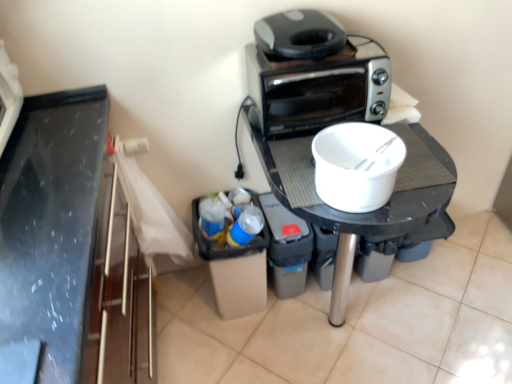
Question: Is white matte bowl at center taller or shorter than silver metallic toaster at upper center?

Choices:
 (A) tall
 (B) short

Answer: (B)

Question: From the image's perspective, relative to silver metallic toaster at upper center, is white matte bowl at center above or below?

Choices:
 (A) above
 (B) below

Answer: (B)

Question: Which object is the closest to the white matte bowl at center?

Choices:
 (A) black plastic table at center
 (B) gray plastic toaster oven at upper right
 (C) silver metallic toaster at upper center
 (D) black plastic trash can at lower center

Answer: (A)

Question: Which of these objects is positioned closest to the black plastic trash can at lower center?

Choices:
 (A) white matte bowl at center
 (B) silver metallic toaster at upper center
 (C) black plastic table at center
 (D) gray plastic toaster oven at upper right

Answer: (C)